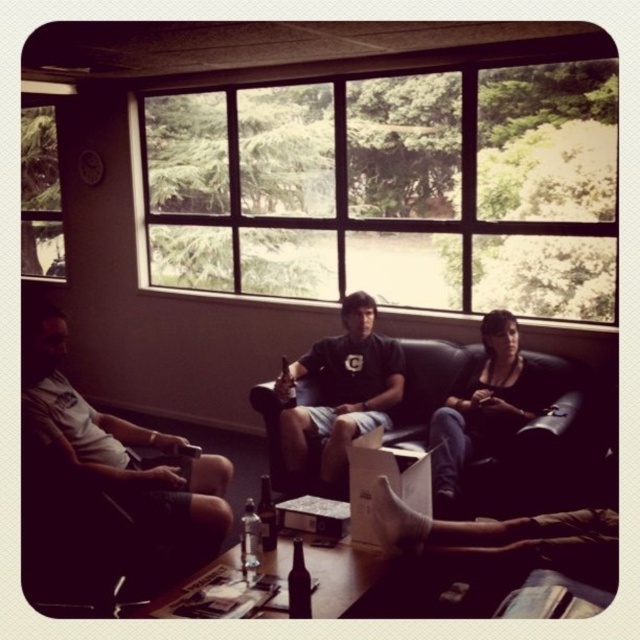
You are a photographer trying to capture a candid shot of the clear glass bottle at center without including the matte white shorts at left in the frame. Given their sizes, is this feasible?

The matte white shorts at left is larger in size than clear glass bottle at center, so it might be challenging to frame the clear glass bottle at center without including the matte white shorts at left due to its larger size.

You are a guest at this gathering and want to grab the clear glass bottle at center to take a drink. However, the matte white shorts at left are covering it. Can you reach the bottle without moving the shorts?

The matte white shorts at left is positioned over clear glass bottle at center, so you cannot reach the bottle without moving the shorts.

You are organizing a photo shoot and need to ensure that the black matte shirt at center and the brown glass bottle at center are both visible in the frame. Given their sizes, which object should you prioritize positioning closer to the camera to maintain visibility?

The black matte shirt at center is larger in size than the brown glass bottle at center, so you should prioritize positioning the brown glass bottle at center closer to the camera to ensure both are visible in the frame.